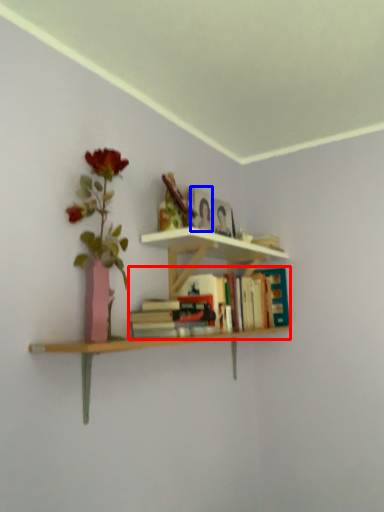
Question: Which of the following is the farthest to the observer, book (highlighted by a red box) or paperback book (highlighted by a blue box)?

Choices:
 (A) book
 (B) paperback book

Answer: (B)